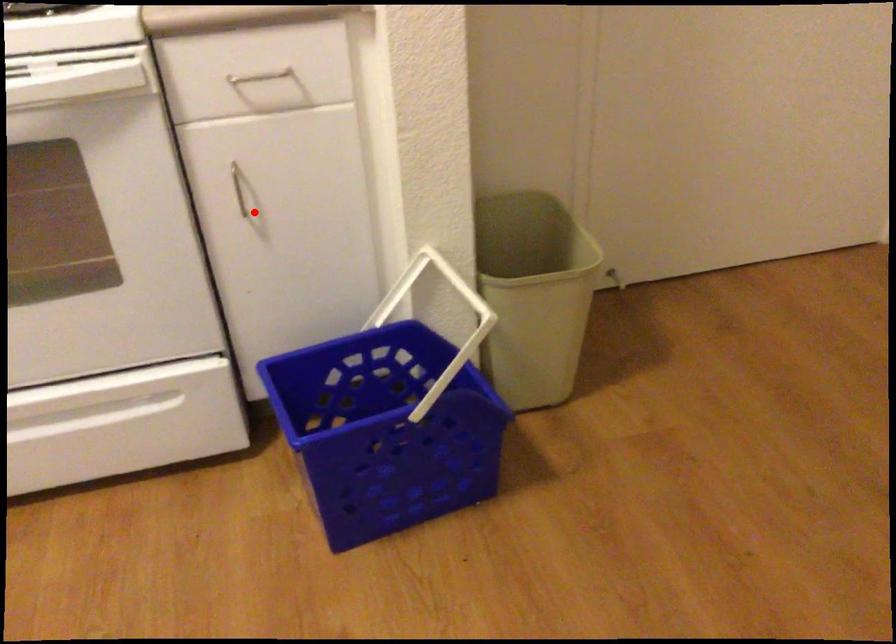
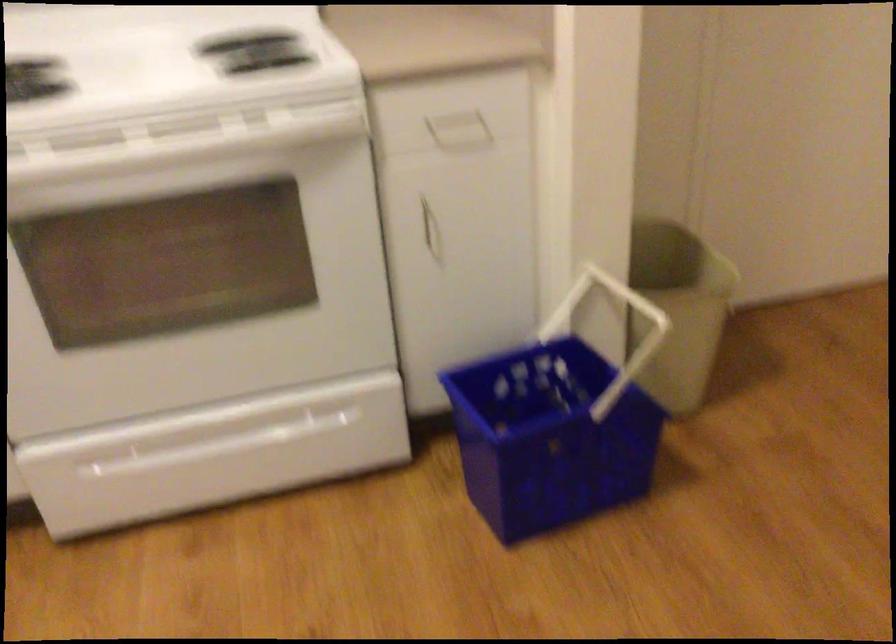
Question: I am providing you with two images of the same scene from different viewpoints. In image1, a red point is highlighted. Considering the same 3D point in image2, which of the following is correct?

Choices:
 (A) It is closer
 (B) It is farther

Answer: (B)